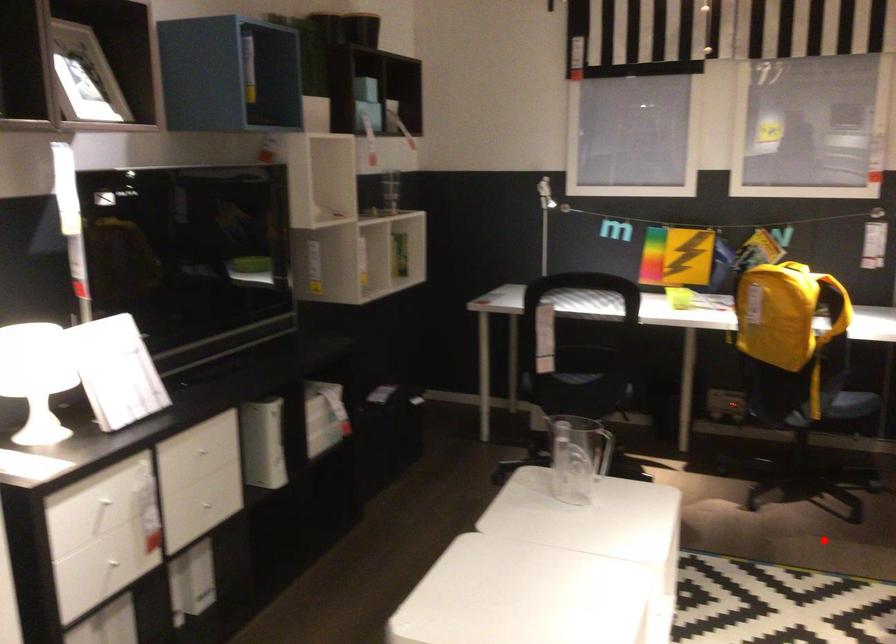
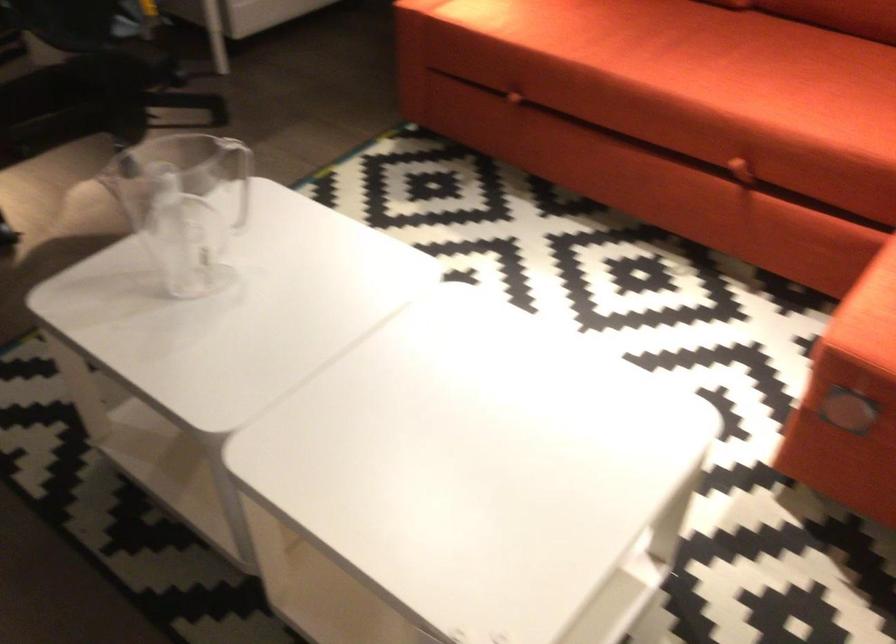
Question: A red point is marked in image1. In image2, is the corresponding 3D point closer to the camera or farther? Reply with the corresponding letter.

Choices:
 (A) The corresponding 3D point is closer.
 (B) The corresponding 3D point is farther.

Answer: (A)